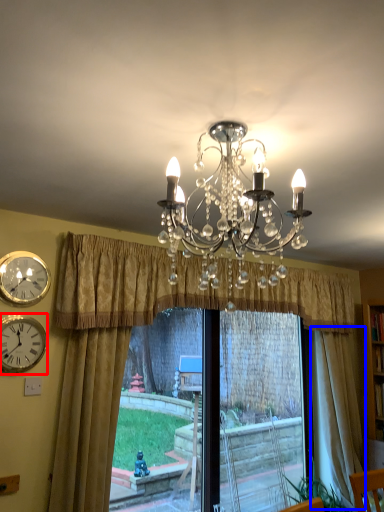
Question: Which point is closer to the camera, wall clock (highlighted by a red box) or curtain (highlighted by a blue box)?

Choices:
 (A) wall clock
 (B) curtain

Answer: (A)